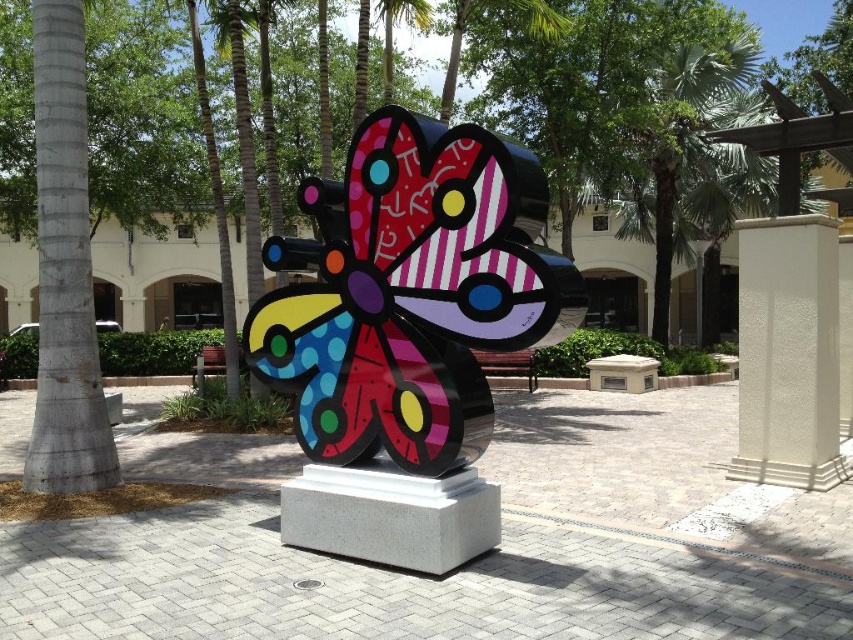
Is smooth concrete pillar at left taller than green leafy palm tree at upper center?

Yes.

Can you confirm if smooth concrete pillar at left is positioned to the right of green leafy palm tree at upper center?

In fact, smooth concrete pillar at left is to the left of green leafy palm tree at upper center.

Image resolution: width=853 pixels, height=640 pixels. I want to click on smooth concrete pillar at left, so click(x=64, y=269).

Who is lower down, metallic multicolored butterfly at center or white textured pillar at center right?

white textured pillar at center right

Can you confirm if metallic multicolored butterfly at center is positioned to the left of white textured pillar at center right?

Correct, you'll find metallic multicolored butterfly at center to the left of white textured pillar at center right.

Who is more forward, (363,376) or (740,433)?

Point (363,376)

Where is `metallic multicolored butterfly at center`? This screenshot has width=853, height=640. metallic multicolored butterfly at center is located at coordinates (410, 292).

Can you confirm if metallic multicolored butterfly at center is positioned below smooth concrete pillar at left?

Yes, metallic multicolored butterfly at center is below smooth concrete pillar at left.

Who is positioned more to the left, metallic multicolored butterfly at center or smooth concrete pillar at left?

From the viewer's perspective, smooth concrete pillar at left appears more on the left side.

Is point (515, 164) less distant than point (74, 230)?

That is True.

The width and height of the screenshot is (853, 640). I want to click on metallic multicolored butterfly at center, so click(x=410, y=292).